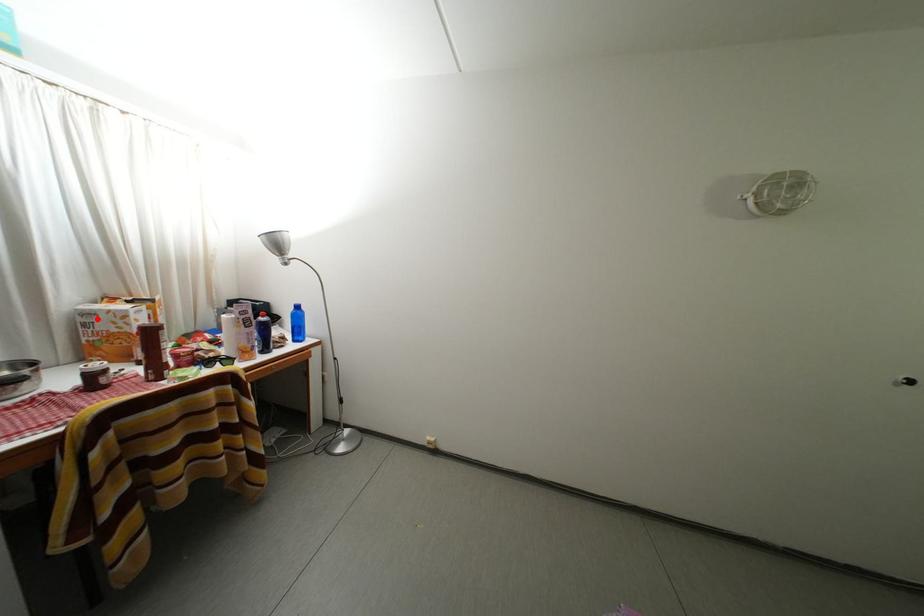
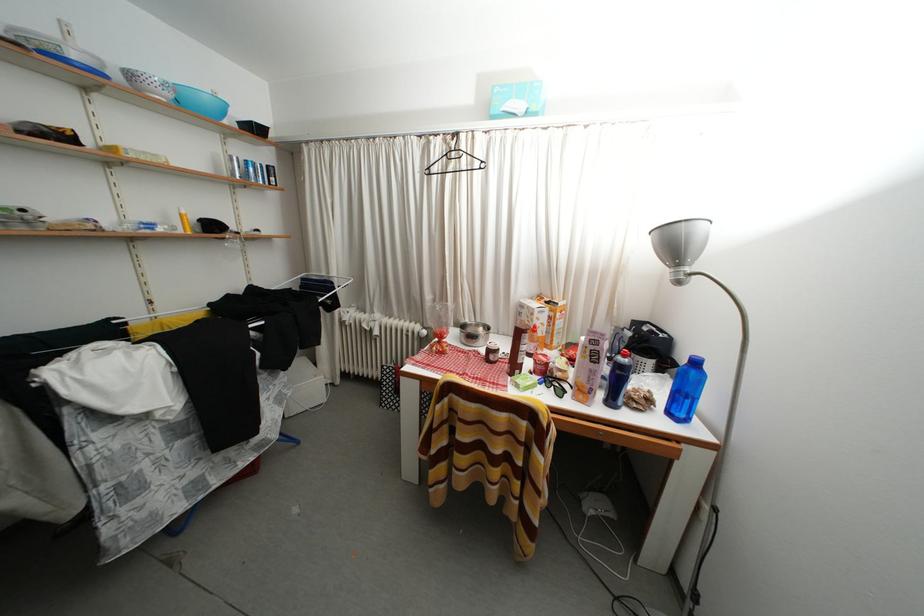
Locate, in the second image, the point that corresponds to the highlighted location in the first image.

(529, 310)